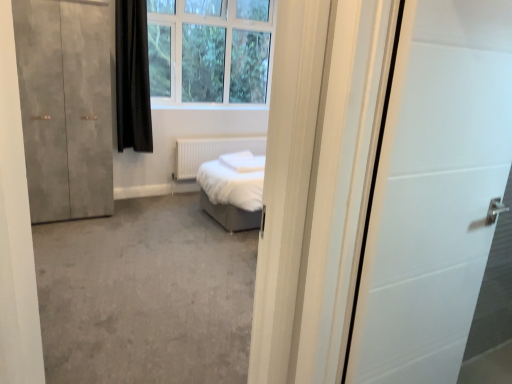
Where is `white plastic window at upper center`? white plastic window at upper center is located at coordinates (210, 50).

Where is `white matte radiator at center`? This screenshot has width=512, height=384. white matte radiator at center is located at coordinates (210, 152).

What is the approximate height of black matte curtain at upper left?

black matte curtain at upper left is 1.46 meters in height.

In order to face black matte curtain at upper left, should I rotate leftwards or rightwards?

Turn left approximately 15.721 degrees to face it.

The width and height of the screenshot is (512, 384). Find the location of `white plastic window at upper center`. white plastic window at upper center is located at coordinates (210, 50).

Are white plastic window at upper center and black matte curtain at upper left beside each other?

No, white plastic window at upper center is not with black matte curtain at upper left.

From the image's perspective, is white plastic window at upper center below black matte curtain at upper left?

No.

Considering the points (176, 31) and (118, 121), which point is in front, point (176, 31) or point (118, 121)?

The point (118, 121) is closer to the camera.

Who is shorter, white plastic window at upper center or black matte curtain at upper left?

white plastic window at upper center is shorter.

Can we say white plastic window at upper center lies outside matte concrete wardrobe at left?

Yes, white plastic window at upper center is located beyond the bounds of matte concrete wardrobe at left.

From the image's perspective, is white plastic window at upper center beneath matte concrete wardrobe at left?

No, from the image's perspective, white plastic window at upper center is not beneath matte concrete wardrobe at left.

Looking at their sizes, would you say white plastic window at upper center is wider or thinner than matte concrete wardrobe at left?

white plastic window at upper center is thinner than matte concrete wardrobe at left.

Between white plastic window at upper center and matte concrete wardrobe at left, which one appears on the left side from the viewer's perspective?

From the viewer's perspective, matte concrete wardrobe at left appears more on the left side.

Is white matte radiator at center positioned with its back to matte concrete wardrobe at left?

No.

From a real-world perspective, between white matte radiator at center and matte concrete wardrobe at left, who is vertically higher?

matte concrete wardrobe at left is physically above.

Does white matte radiator at center have a smaller size compared to matte concrete wardrobe at left?

Correct, white matte radiator at center occupies less space than matte concrete wardrobe at left.

Considering the points (118, 105) and (54, 53), which point is in front, point (118, 105) or point (54, 53)?

The point (54, 53) is more forward.

Where is `door located on the left of black matte curtain at upper left`? The image size is (512, 384). door located on the left of black matte curtain at upper left is located at coordinates (65, 106).

Is black matte curtain at upper left spatially inside matte concrete wardrobe at left, or outside of it?

black matte curtain at upper left cannot be found inside matte concrete wardrobe at left.

Can you tell me how much black matte curtain at upper left and white plastic window at upper center differ in facing direction?

2.87 degrees.

Are black matte curtain at upper left and white plastic window at upper center making contact?

There is a gap between black matte curtain at upper left and white plastic window at upper center.

Considering the positions of points (130, 20) and (255, 2), is point (130, 20) closer to camera compared to point (255, 2)?

Yes.

Could you tell me if white plastic window at upper center is turned towards white matte radiator at center?

No, white plastic window at upper center is not facing towards white matte radiator at center.

Who is bigger, white plastic window at upper center or white matte radiator at center?

With larger size is white plastic window at upper center.

Find the location of a particular element. window on the right of white matte radiator at center is located at coordinates (210, 50).

Does white plastic window at upper center appear on the left side of white matte radiator at center?

No.

Considering the sizes of white matte radiator at center and black matte curtain at upper left in the image, is white matte radiator at center taller or shorter than black matte curtain at upper left?

white matte radiator at center is shorter than black matte curtain at upper left.

Consider the image. Is white matte radiator at center touching black matte curtain at upper left?

No, white matte radiator at center is not making contact with black matte curtain at upper left.

From the image's perspective, is white matte radiator at center above or below black matte curtain at upper left?

Clearly, from the image's perspective, white matte radiator at center is below black matte curtain at upper left.

Locate an element on the screen. The height and width of the screenshot is (384, 512). window behind the black matte curtain at upper left is located at coordinates (210, 50).

Image resolution: width=512 pixels, height=384 pixels. What are the coordinates of `door lying below the white plastic window at upper center (from the image's perspective)` in the screenshot? It's located at (65, 106).

When comparing their distances from white plastic window at upper center, does matte concrete wardrobe at left or white matte radiator at center seem closer?

Among the two, white matte radiator at center is located nearer to white plastic window at upper center.

Estimate the real-world distances between objects in this image. Which object is closer to white matte radiator at center, black matte curtain at upper left or matte concrete wardrobe at left?

black matte curtain at upper left is positioned closer to the anchor white matte radiator at center.

Estimate the real-world distances between objects in this image. Which object is closer to white matte radiator at center, matte concrete wardrobe at left or black matte curtain at upper left?

black matte curtain at upper left is closer to white matte radiator at center.

Considering their positions, is matte concrete wardrobe at left positioned closer to white plastic window at upper center than black matte curtain at upper left?

The object closer to white plastic window at upper center is black matte curtain at upper left.

Estimate the real-world distances between objects in this image. Which object is closer to white plastic window at upper center, black matte curtain at upper left or matte concrete wardrobe at left?

black matte curtain at upper left is closer to white plastic window at upper center.

From the image, which object appears to be farther from matte concrete wardrobe at left, white matte radiator at center or black matte curtain at upper left?

white matte radiator at center.

Consider the image. Which object lies further to the anchor point white matte radiator at center, white plastic window at upper center or matte concrete wardrobe at left?

The object further to white matte radiator at center is matte concrete wardrobe at left.

From the image, which object appears to be farther from white matte radiator at center, black matte curtain at upper left or white plastic window at upper center?

white plastic window at upper center lies further to white matte radiator at center than the other object.

I want to click on curtain positioned between matte concrete wardrobe at left and white matte radiator at center from near to far, so click(132, 77).

At what (x,y) coordinates should I click in order to perform the action: click on curtain between matte concrete wardrobe at left and white plastic window at upper center in the horizontal direction. Please return your answer as a coordinate pair (x, y). Looking at the image, I should click on (132, 77).

The width and height of the screenshot is (512, 384). Find the location of `radiator located between matte concrete wardrobe at left and white plastic window at upper center in the left-right direction`. radiator located between matte concrete wardrobe at left and white plastic window at upper center in the left-right direction is located at coordinates (210, 152).

At what (x,y) coordinates should I click in order to perform the action: click on curtain that lies between white plastic window at upper center and white matte radiator at center from top to bottom. Please return your answer as a coordinate pair (x, y). Looking at the image, I should click on (132, 77).